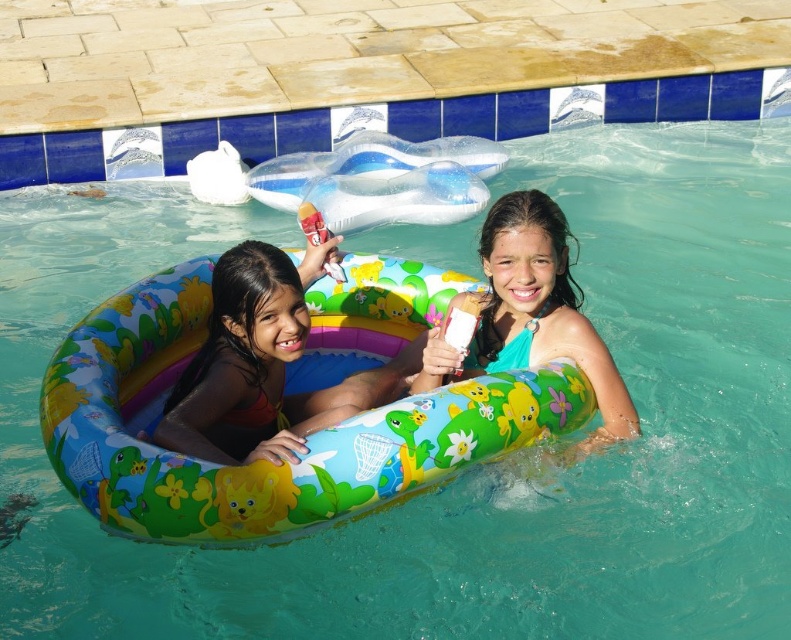
You are a photographer taking a picture of the two girls in the swimming pool. You want to focus on the girl holding the small object. Which of the two points, point 1 at coordinates (456, 305) or point 2 at (218, 458), is closer to the camera and thus should be prioritized for focus?

Point 1 at coordinates (456, 305) is closer to the camera than point 2 at (218, 458). Therefore, focusing on point 1 at coordinates (456, 305) would ensure the girl holding the small object is in sharp focus.

You are trying to locate the multicolored inflatable ring at center in the swimming pool scene. Based on the coordinates provided, where exactly is it positioned?

The multicolored inflatable ring at center is located at point 0.502 on the x axis and 0.654 on the y axis.